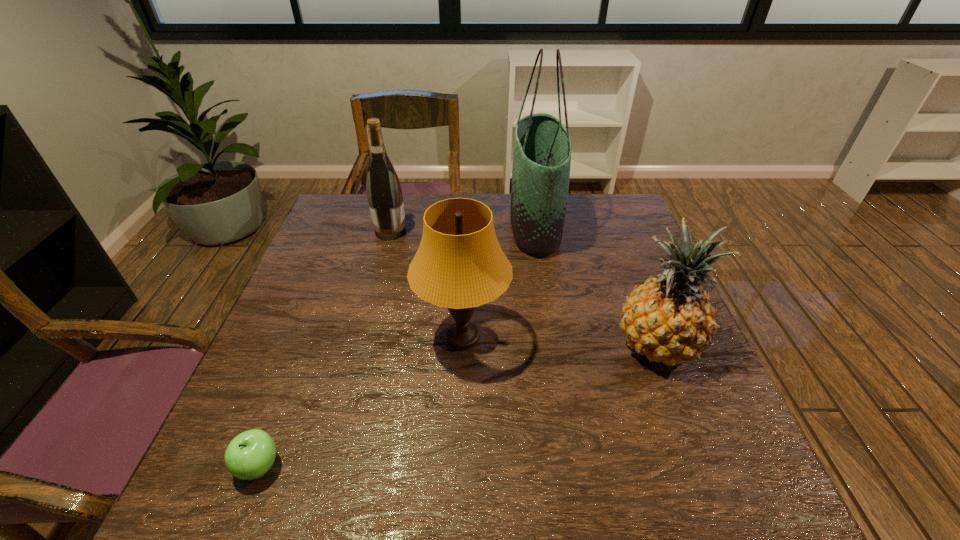
In the image, there is a desktop. At what (x,y) coordinates should I click in order to perform the action: click on vacant area at the right edge. Please return your answer as a coordinate pair (x, y). Looking at the image, I should click on (622, 314).

I want to click on free space at the far left corner, so click(x=345, y=219).

At what (x,y) coordinates should I click in order to perform the action: click on vacant space at the near left corner of the desktop. Please return your answer as a coordinate pair (x, y). Image resolution: width=960 pixels, height=540 pixels. Looking at the image, I should click on (271, 508).

Locate an element on the screen. This screenshot has width=960, height=540. vacant space at the far right corner is located at coordinates (629, 213).

Where is `free spot between the wine bottle and the pineapple`? free spot between the wine bottle and the pineapple is located at coordinates (523, 288).

The image size is (960, 540). I want to click on free point between the nearest object and the lampshade, so click(361, 402).

Identify the location of vacant area between the third object from left to right and the pineapple. (560, 341).

The width and height of the screenshot is (960, 540). What are the coordinates of `vacant area that lies between the shortest object and the pineapple` in the screenshot? It's located at (457, 406).

Locate an element on the screen. The image size is (960, 540). vacant point located between the third object from right to left and the apple is located at coordinates (361, 402).

The width and height of the screenshot is (960, 540). Find the location of `free area in between the rightmost object and the lampshade`. free area in between the rightmost object and the lampshade is located at coordinates (560, 341).